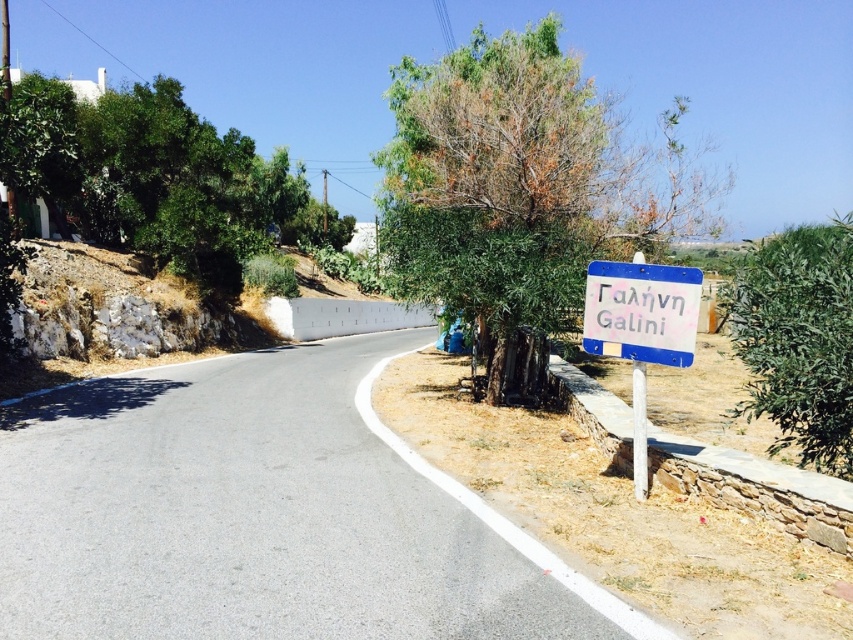
Question: Which of these objects is positioned closest to the green leafy tree at center right?

Choices:
 (A) green leafy tree at upper left
 (B) blue plastic sign at right
 (C) white plastic sign at right
 (D) gray asphalt road at center

Answer: (B)

Question: In this image, where is green leafy tree at center located relative to green leafy tree at center right?

Choices:
 (A) right
 (B) left

Answer: (B)

Question: Which object appears closest to the camera in this image?

Choices:
 (A) green leafy tree at center right
 (B) blue plastic sign at right

Answer: (A)

Question: In this image, where is gray asphalt road at center located relative to green leafy tree at upper left?

Choices:
 (A) left
 (B) right

Answer: (B)

Question: Is green leafy tree at upper left thinner than white plastic sign at right?

Choices:
 (A) yes
 (B) no

Answer: (B)

Question: Which of these objects is positioned closest to the green leafy tree at upper left?

Choices:
 (A) green leafy tree at center
 (B) blue plastic sign at right
 (C) green leafy tree at center right

Answer: (A)